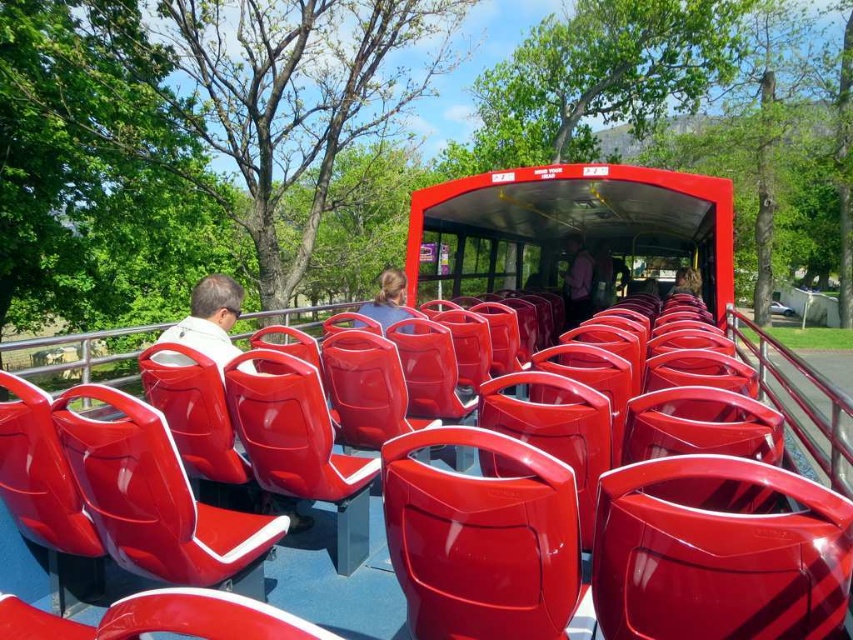
You are a tour guide standing at the front of the red open top tour bus. You see a pink fabric shirt at center and a matte blue shirt at center. A passenger asks you if they can safely walk between these two shirts without needing to move either. What do you tell them?

The pink fabric shirt at center is 4.84 meters from matte blue shirt at center, so yes, they can safely walk between them as there is sufficient space between the two shirts.

You are a tour guide standing inside the red open top tour bus. You notice two tourists wearing the matte white shirt at left and the matte blue shirt at center. Which tourist is shorter in height?

The matte white shirt at left has a lesser height compared to the matte blue shirt at center, so the tourist wearing the matte white shirt at left is shorter.

You are a tour guide on the red open top bus and you see two shirts in the scene. Which shirt is positioned more to the left, the matte white shirt at left or the pink fabric shirt at center?

The matte white shirt at left is positioned more to the left than the pink fabric shirt at center.